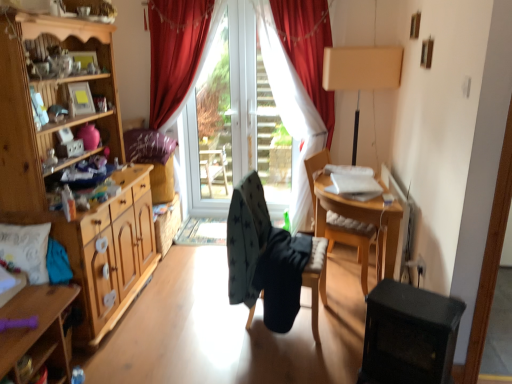
Question: Is wooden chair at right, which ranks as the first chair in right-to-left order, at the back of white textured pillow at left, the first pillow when ordered from front to back?

Choices:
 (A) no
 (B) yes

Answer: (A)

Question: Is white textured pillow at left, the second pillow when ordered from back to front, further to camera compared to wooden chair at right, which ranks as the first chair in right-to-left order?

Choices:
 (A) no
 (B) yes

Answer: (A)

Question: Is white textured pillow at left, the second pillow when ordered from back to front, to the right of wooden chair at right, which ranks as the first chair in right-to-left order, from the viewer's perspective?

Choices:
 (A) yes
 (B) no

Answer: (B)

Question: Does white textured pillow at left, positioned as the first pillow in bottom-to-top order, have a lesser width compared to wooden chair at right, which ranks as the first chair in right-to-left order?

Choices:
 (A) no
 (B) yes

Answer: (B)

Question: Is white textured pillow at left, the first pillow when ordered from front to back, closer to camera compared to wooden chair at right, which ranks as the first chair in right-to-left order?

Choices:
 (A) yes
 (B) no

Answer: (A)

Question: From the image's perspective, is white textured pillow at left, the first pillow when ordered from front to back, under wooden chair at right, which ranks as the first chair in right-to-left order?

Choices:
 (A) yes
 (B) no

Answer: (A)

Question: From a real-world perspective, is white textured pillow at left, which ranks as the second pillow in top-to-bottom order, positioned over velvet purple pillow at upper center, the second pillow from the front, based on gravity?

Choices:
 (A) yes
 (B) no

Answer: (B)

Question: Is white textured pillow at left, the first pillow when ordered from front to back, wider than velvet purple pillow at upper center, which ranks as the first pillow in back-to-front order?

Choices:
 (A) no
 (B) yes

Answer: (A)

Question: From the image's perspective, is white textured pillow at left, positioned as the first pillow in bottom-to-top order, above velvet purple pillow at upper center, which ranks as the first pillow in back-to-front order?

Choices:
 (A) yes
 (B) no

Answer: (B)

Question: Does white textured pillow at left, which ranks as the second pillow in top-to-bottom order, have a lesser height compared to velvet purple pillow at upper center, the 2th pillow from the bottom?

Choices:
 (A) no
 (B) yes

Answer: (A)

Question: Can you confirm if white textured pillow at left, which ranks as the second pillow in top-to-bottom order, is positioned to the right of velvet purple pillow at upper center, which appears as the first pillow when viewed from the top?

Choices:
 (A) no
 (B) yes

Answer: (A)

Question: From the image's perspective, is white textured pillow at left, the second pillow when ordered from back to front, below velvet purple pillow at upper center, the 2th pillow from the bottom?

Choices:
 (A) yes
 (B) no

Answer: (A)

Question: Is wooden table at center wider than transparent glass door at center?

Choices:
 (A) no
 (B) yes

Answer: (B)